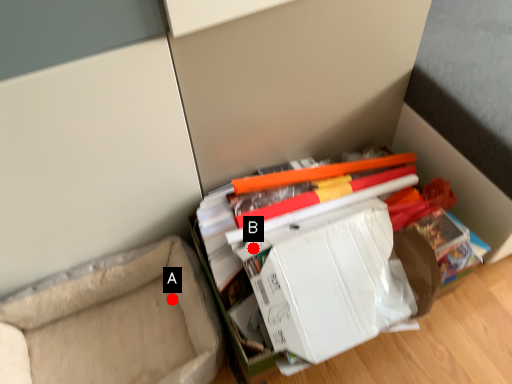
Question: Two points are circled on the image, labeled by A and B beside each circle. Among these points, which one is nearest to the camera?

Choices:
 (A) A is closer
 (B) B is closer

Answer: (B)